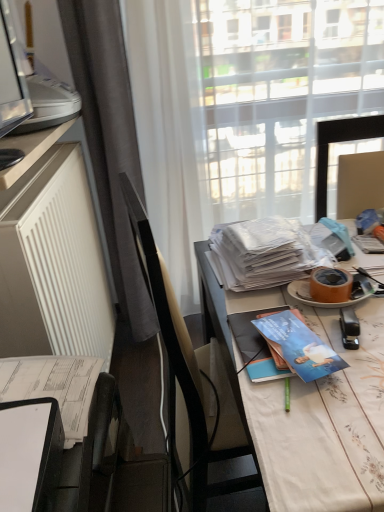
Where is `free spot in front of matte brown adhesive tape at right`? free spot in front of matte brown adhesive tape at right is located at coordinates (350, 333).